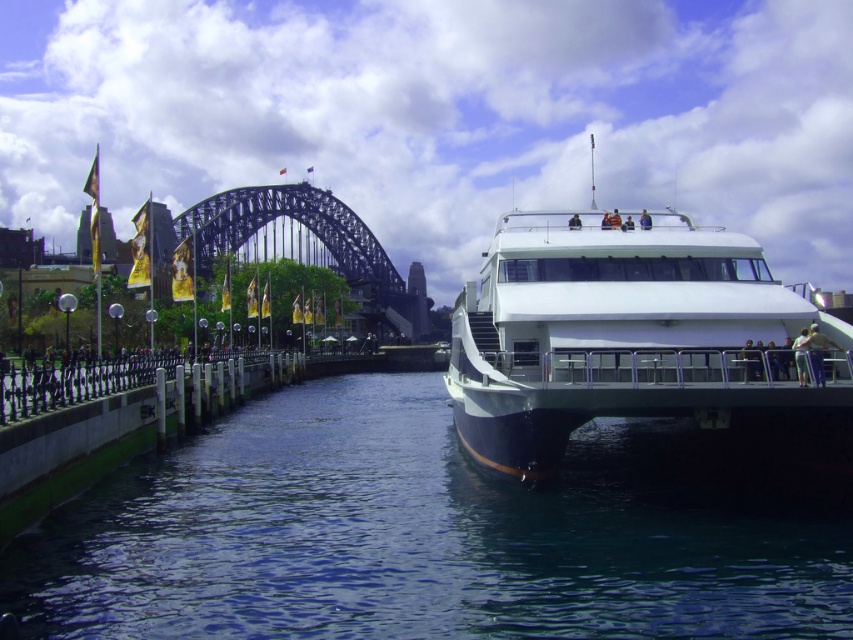
You are a photographer planning to capture a wide shot of the waterfront scene at Circular Quay. You want to ensure both the blue water at center and the metallic steel bridge at upper center are clearly visible in your photo. Considering their sizes, which object should you prioritize framing closer to the edge of the frame to avoid overcrowding?

The blue water at center has a smaller size compared to the metallic steel bridge at upper center. To avoid overcrowding, prioritize framing the larger metallic steel bridge at upper center closer to the edge of the frame, allowing the smaller blue water at center to occupy less space in the composition.

From the picture: You are standing at the ferry dock and see two points marked on the water surface. One is at coordinates point (173, 547) and the other at point (665, 323). If you want to walk from the ferry to the point that is closer to you, which coordinate should you head towards?

You should head towards point (173, 547) because it is in front of point (665, 323), meaning it is closer to your current position at the ferry dock.

Consider the image. You are standing at Circular Quay and want to take a photo of the Sydney Harbour Bridge. To ensure the blue water at center is in the frame, where should you position your camera relative to the bridge?

The blue water at center is located at coordinates point (433, 532), so position your camera to capture that point to include the blue water at center in the photo.